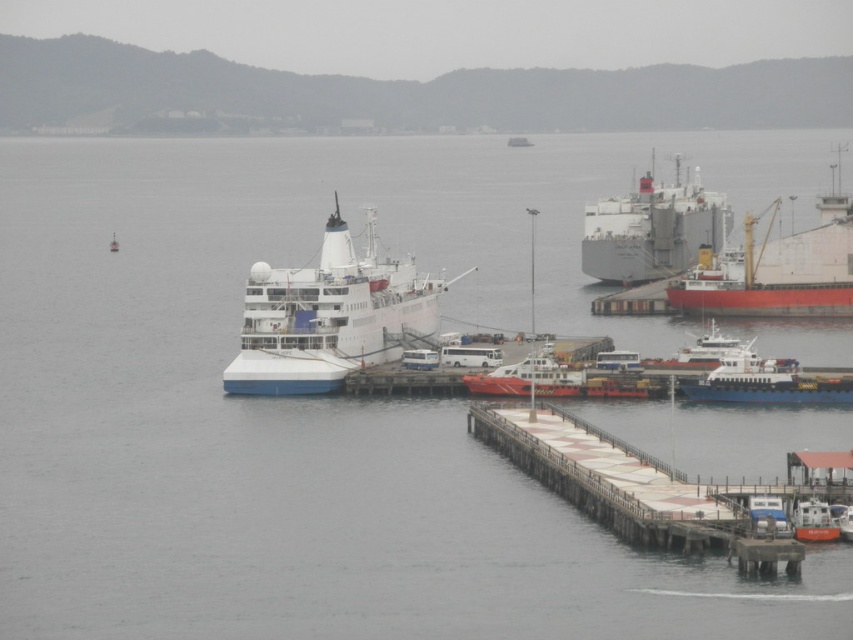
You are a harbor pilot navigating a new ship into the harbor. You see the red matte cargo ship at right. Based on its position, can you determine if it is anchored or moving?

The red matte cargo ship at right is located at point (776, 272), which indicates it is anchored in the harbor.

You are standing at the camera position and want to reach the point at coordinates point (584, 470). If your walking speed is 3 feet per second, how many seconds will it take you to reach there?

The point at coordinates point (584, 470) is 294.44 feet away from the camera. At a walking speed of 3 feet per second, it would take approximately 98.15 seconds to reach there.